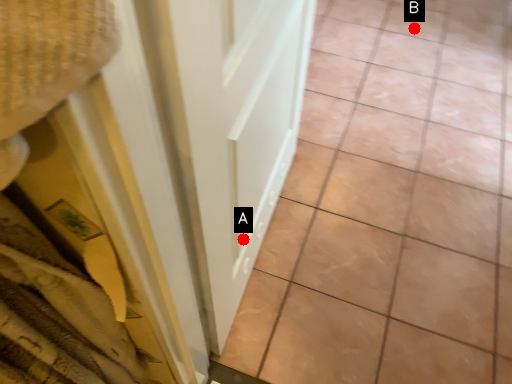
Question: Two points are circled on the image, labeled by A and B beside each circle. Which point is further to the camera?

Choices:
 (A) A is further
 (B) B is further

Answer: (B)